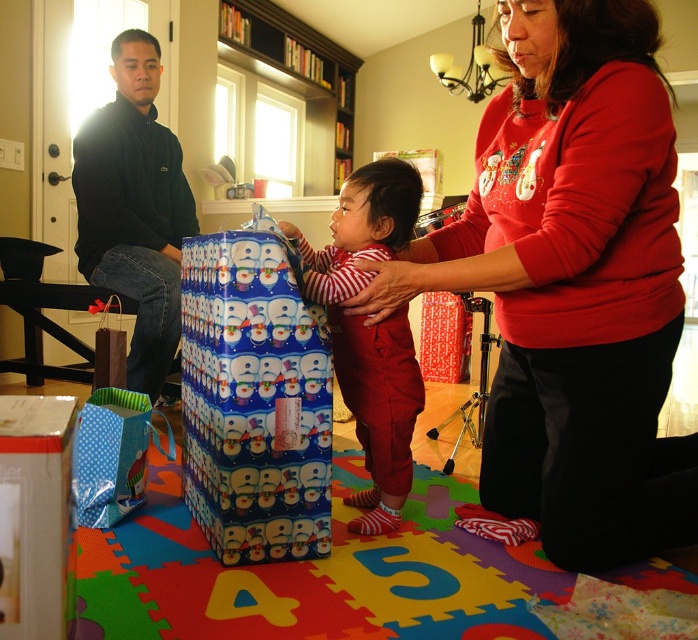
Question: Which point is farther to the camera?

Choices:
 (A) (82, 259)
 (B) (521, 246)

Answer: (A)

Question: Is blue paper wrapped gift at center positioned at the back of striped cotton onesie at center?

Choices:
 (A) yes
 (B) no

Answer: (B)

Question: Is matte red sweater at center positioned before white cardboard box at lower left?

Choices:
 (A) no
 (B) yes

Answer: (A)

Question: Which point appears closest to the camera in this image?

Choices:
 (A) (359, 230)
 (B) (556, 307)
 (C) (260, 504)
 (D) (22, 600)

Answer: (D)

Question: Which object is the farthest from the striped cotton onesie at center?

Choices:
 (A) white cardboard box at lower left
 (B) blue paper wrapped gift at center

Answer: (A)

Question: Does matte red sweater at center come behind dark blue fleece jacket at left?

Choices:
 (A) yes
 (B) no

Answer: (B)